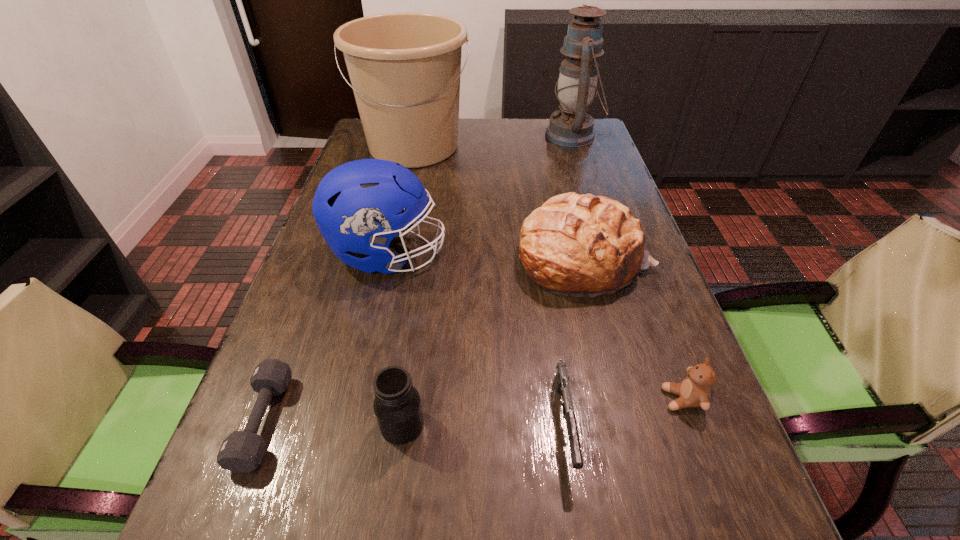
Where is `vacant region at the right edge of the desktop`? vacant region at the right edge of the desktop is located at coordinates 641,355.

In the image, there is a desktop. Where is `vacant space at the far left corner`? vacant space at the far left corner is located at coordinates (369, 151).

The height and width of the screenshot is (540, 960). In order to click on vacant space that's between the seventh tallest object and the third shortest object in this screenshot , I will do `click(623, 412)`.

The width and height of the screenshot is (960, 540). Identify the location of free space between the oil lamp and the shortest object. (419, 279).

Where is `free area in between the bucket and the jar`? Image resolution: width=960 pixels, height=540 pixels. free area in between the bucket and the jar is located at coordinates (408, 285).

You are a GUI agent. You are given a task and a screenshot of the screen. Output one action in this format:
    pyautogui.click(x=<x>, y=<y>)
    Task: Click on the vacant point located between the jar and the oil lamp
    
    Given the screenshot: What is the action you would take?
    pyautogui.click(x=488, y=280)

Find the location of a particular element. The image size is (960, 540). free point between the oil lamp and the bucket is located at coordinates (493, 141).

The width and height of the screenshot is (960, 540). I want to click on unoccupied area between the oil lamp and the sixth shortest object, so click(x=480, y=195).

Where is `empty space that is in between the football helmet and the second shortest object`? empty space that is in between the football helmet and the second shortest object is located at coordinates (476, 340).

Where is `empty space between the oil lamp and the sixth shortest object`? The width and height of the screenshot is (960, 540). empty space between the oil lamp and the sixth shortest object is located at coordinates click(x=480, y=195).